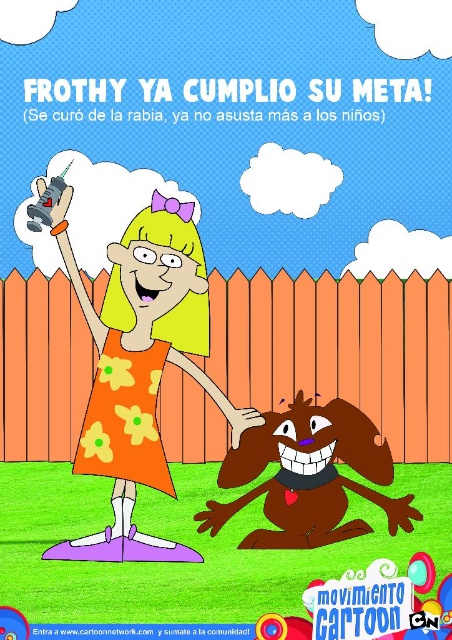
Between orange floral dress at center and brown furry dog at lower center, which one has more height?

orange floral dress at center is taller.

Between orange floral dress at center and brown furry dog at lower center, which one appears on the right side from the viewer's perspective?

brown furry dog at lower center is more to the right.

Who is more forward, (180, 243) or (300, 456)?

Point (300, 456)

Where is `orange floral dress at center`? This screenshot has height=640, width=452. orange floral dress at center is located at coordinates (141, 348).